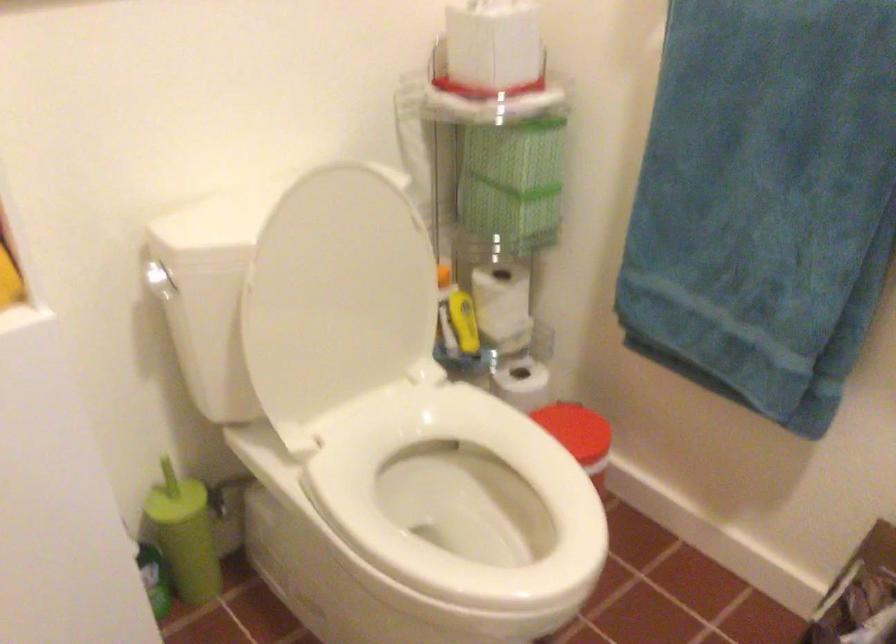
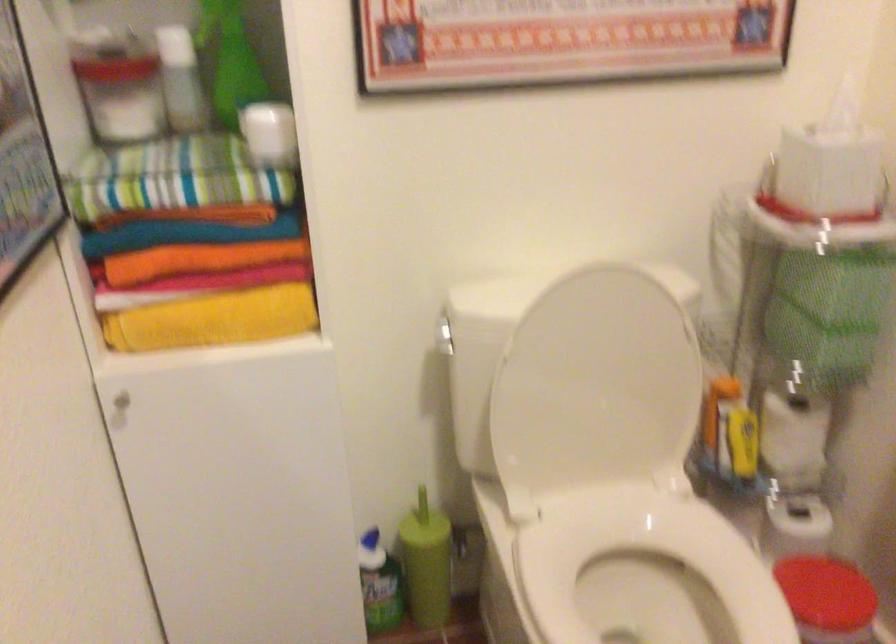
Find the pixel in the second image that matches point 429,468 in the first image.

(648, 578)